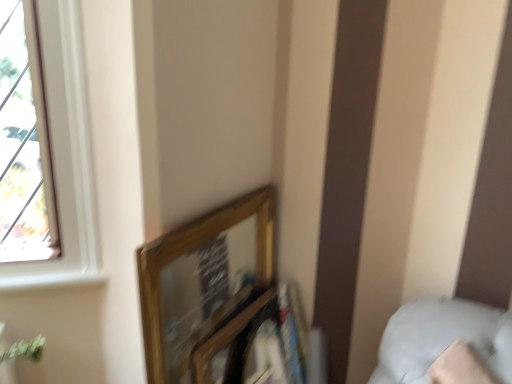
Question: From a real-world perspective, is white soft pillow at lower right positioned under wooden frame at upper center based on gravity?

Choices:
 (A) yes
 (B) no

Answer: (B)

Question: Does white soft pillow at lower right have a smaller size compared to wooden frame at upper center?

Choices:
 (A) yes
 (B) no

Answer: (B)

Question: Is white soft pillow at lower right to the right of wooden frame at upper center from the viewer's perspective?

Choices:
 (A) no
 (B) yes

Answer: (B)

Question: Considering the relative sizes of white soft pillow at lower right and wooden frame at upper center in the image provided, is white soft pillow at lower right bigger than wooden frame at upper center?

Choices:
 (A) yes
 (B) no

Answer: (A)

Question: Is white soft pillow at lower right completely or partially outside of wooden frame at upper center?

Choices:
 (A) no
 (B) yes

Answer: (B)

Question: Is wooden frame at upper center at the back of white soft pillow at lower right?

Choices:
 (A) yes
 (B) no

Answer: (B)

Question: Does wooden frame at upper center have a greater width compared to white soft pillow at lower right?

Choices:
 (A) no
 (B) yes

Answer: (A)

Question: Is wooden frame at upper center taller than white soft pillow at lower right?

Choices:
 (A) no
 (B) yes

Answer: (B)

Question: Can you confirm if wooden frame at upper center is smaller than white soft pillow at lower right?

Choices:
 (A) yes
 (B) no

Answer: (A)

Question: Is wooden frame at upper center facing away from white soft pillow at lower right?

Choices:
 (A) no
 (B) yes

Answer: (A)

Question: From a real-world perspective, is wooden frame at upper center under white soft pillow at lower right?

Choices:
 (A) yes
 (B) no

Answer: (A)

Question: Can you confirm if wooden frame at upper center is shorter than white soft pillow at lower right?

Choices:
 (A) no
 (B) yes

Answer: (A)

Question: Visually, is white soft pillow at lower right positioned to the left or to the right of wooden frame at upper center?

Choices:
 (A) left
 (B) right

Answer: (B)